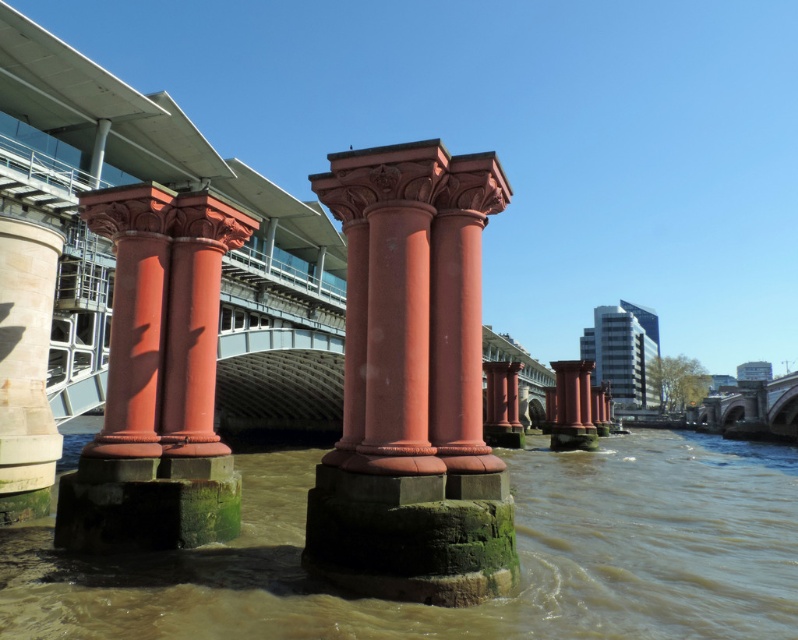
Does green mossy concrete at lower center appear over matte red column at center?

No, green mossy concrete at lower center is not above matte red column at center.

Measure the distance between green mossy concrete at lower center and matte red column at center.

green mossy concrete at lower center and matte red column at center are 6.70 meters apart from each other.

Locate an element on the screen. Image resolution: width=798 pixels, height=640 pixels. green mossy concrete at lower center is located at coordinates (482, 604).

Is matte red column at left positioned at the back of white stone column at left?

No, matte red column at left is in front of white stone column at left.

Is point (153, 330) behind point (32, 280)?

That is False.

Where is `matte red column at left`? matte red column at left is located at coordinates (132, 314).

Does green mossy concrete at lower center have a smaller size compared to matte red column at left?

Incorrect, green mossy concrete at lower center is not smaller in size than matte red column at left.

Who is positioned more to the right, green mossy concrete at lower center or matte red column at left?

From the viewer's perspective, green mossy concrete at lower center appears more on the right side.

Locate an element on the screen. The height and width of the screenshot is (640, 798). green mossy concrete at lower center is located at coordinates (482, 604).